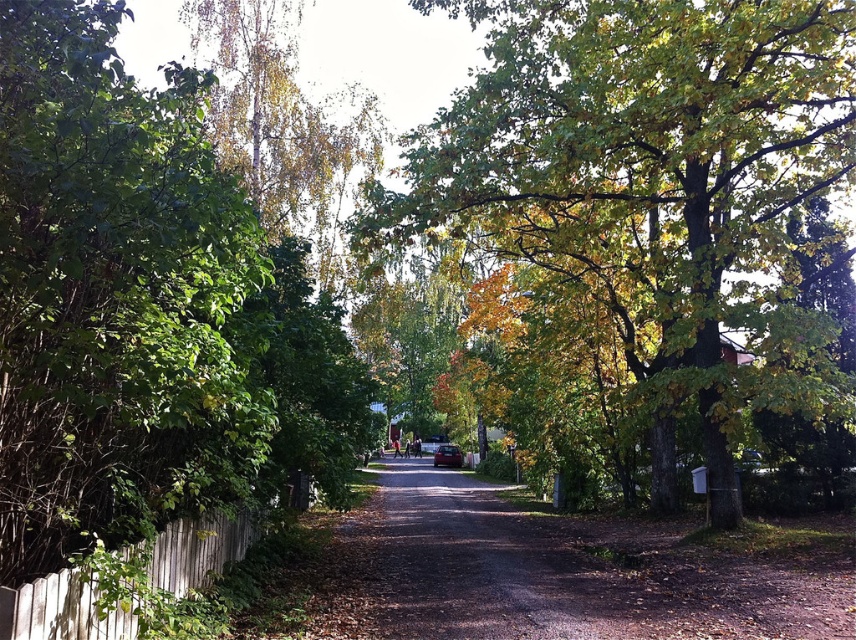
You are standing at the point labeled as point (x=141, y=307) on the image. Looking around, you see a green leafy tree at left. Which direction should you walk to get closer to the green leafy tree at left?

Since the point (x=141, y=307) is already on the green leafy tree at left, you are already at the tree. No need to walk further.

You are a delivery person trying to park your metallic silver car at center near the white wooden fence at lower left. Considering the height difference between them, will the car fit under the fence without any adjustments?

The white wooden fence at lower left has a greater height compared to metallic silver car at center. Since the fence is taller, the car should fit under it without any issues.

You are standing at the starting point of the path and want to reach a destination located at point [34,627]. There is an obstacle at point [688,227] that you need to avoid. Which direction should you move to go around the obstacle and continue towards your destination?

Since point [688,227] is closer to you than point [34,627], you should move around the obstacle by going either to the left or right to bypass it while heading towards the destination.